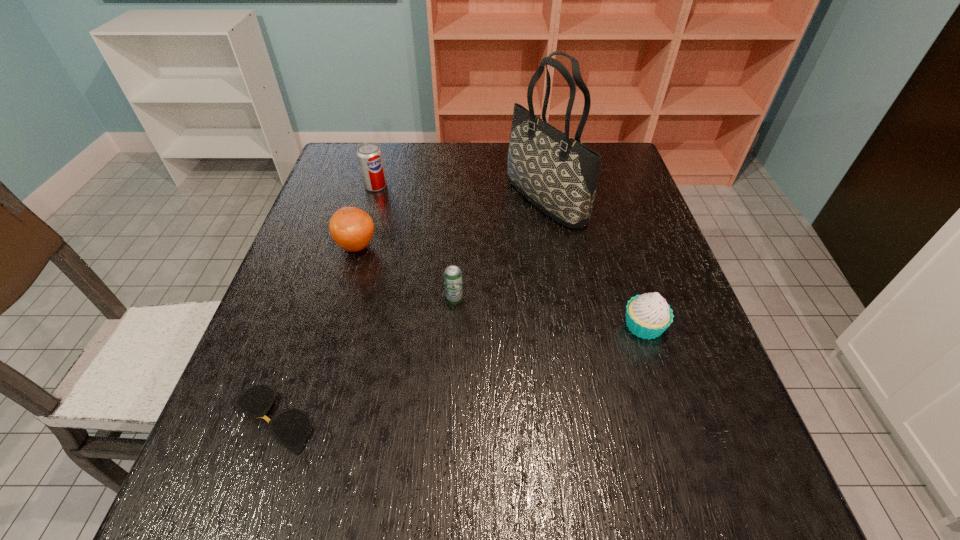
This screenshot has width=960, height=540. What are the coordinates of `free space that satisfies the following two spatial constraints: 1. on the back side of the fifth object from left to right; 2. on the left side of the nearest object` in the screenshot? It's located at (347, 200).

At what (x,y) coordinates should I click in order to perform the action: click on vacant point that satisfies the following two spatial constraints: 1. on the front side of the fourth object from left to right; 2. on the right side of the soda. Please return your answer as a coordinate pair (x, y). Image resolution: width=960 pixels, height=540 pixels. Looking at the image, I should click on (343, 301).

You are a GUI agent. You are given a task and a screenshot of the screen. Output one action in this format:
    pyautogui.click(x=<x>, y=<y>)
    Task: Click on the free spot that satisfies the following two spatial constraints: 1. on the back side of the tallest object; 2. on the right side of the fourth farthest object
    This screenshot has height=540, width=960.
    Given the screenshot: What is the action you would take?
    pyautogui.click(x=460, y=200)